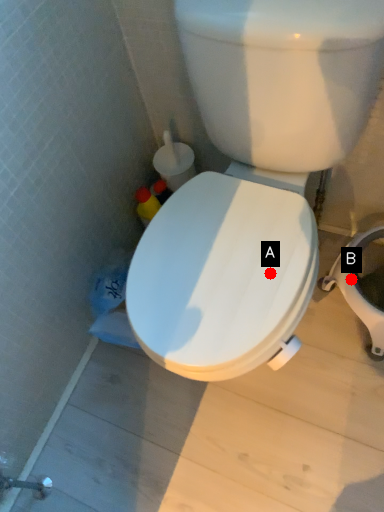
Question: Two points are circled on the image, labeled by A and B beside each circle. Which point is further to the camera?

Choices:
 (A) A is further
 (B) B is further

Answer: (B)